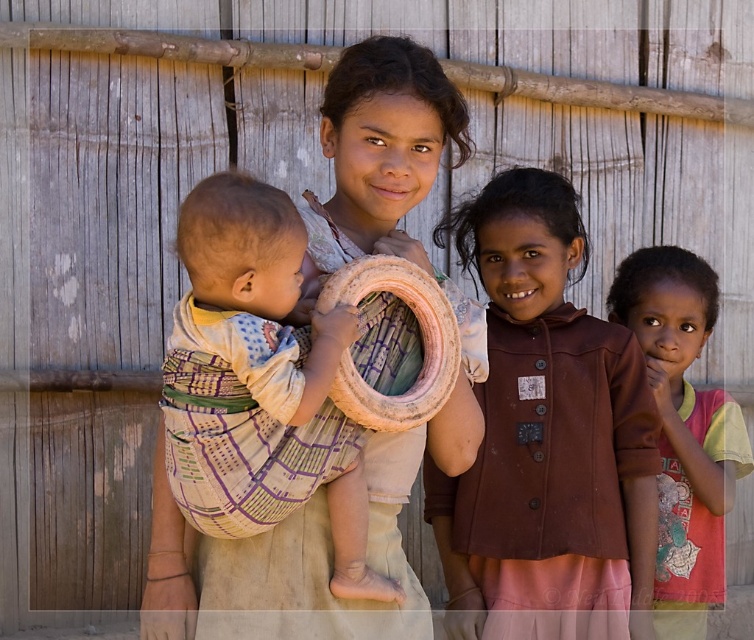
You are a photographer trying to capture the soft beige fabric baby at center. Given that the camera is focused on the center of the image, which is at point 0.5, 0.5, will the baby be in focus?

The soft beige fabric baby at center is located at point (259, 381), which is close to the center coordinates of (377, 320). Therefore, the baby should be in focus.

You are a photographer trying to capture a photo of the brown matte jacket at center and the soft beige fabric baby at center. You need to ensure both are fully visible in the frame. Based on their sizes, which object might require you to adjust your camera angle to avoid cropping?

The brown matte jacket at center might be wider than the soft beige fabric baby at center, so you might need to adjust your camera angle to ensure the entire jacket is visible without cropping.

You are a photographer trying to capture the children in the scene. You notice the brown matte jacket at center and the pink fabric shirt at right. Which clothing item is positioned higher in the image?

Result: The brown matte jacket at center is above the pink fabric shirt at right, so it is positioned higher in the image.